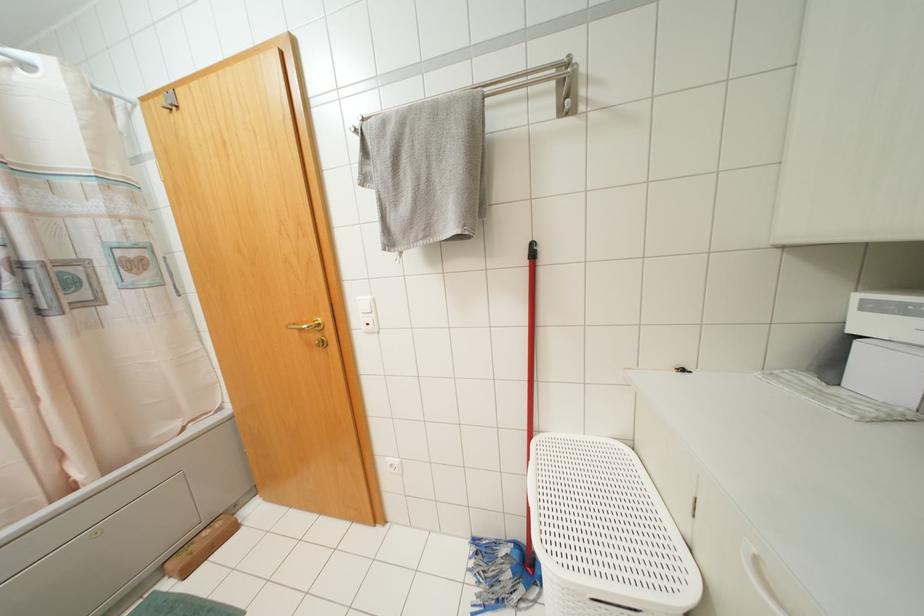
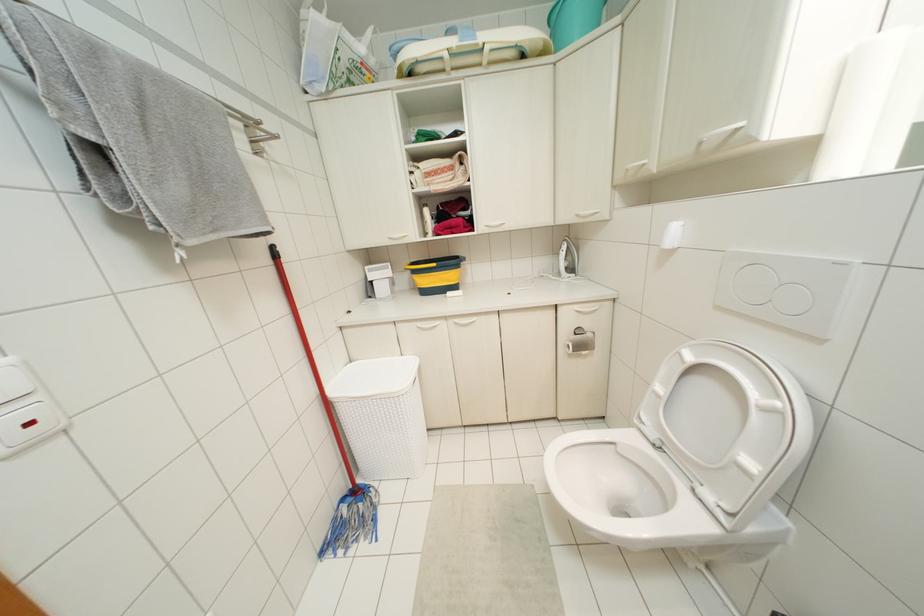
Question: The camera is either moving clockwise (left) or counter-clockwise (right) around the object. The first image is from the beginning of the video and the second image is from the end. Is the camera moving left or right when shooting the video?

Choices:
 (A) Left
 (B) Right

Answer: (A)